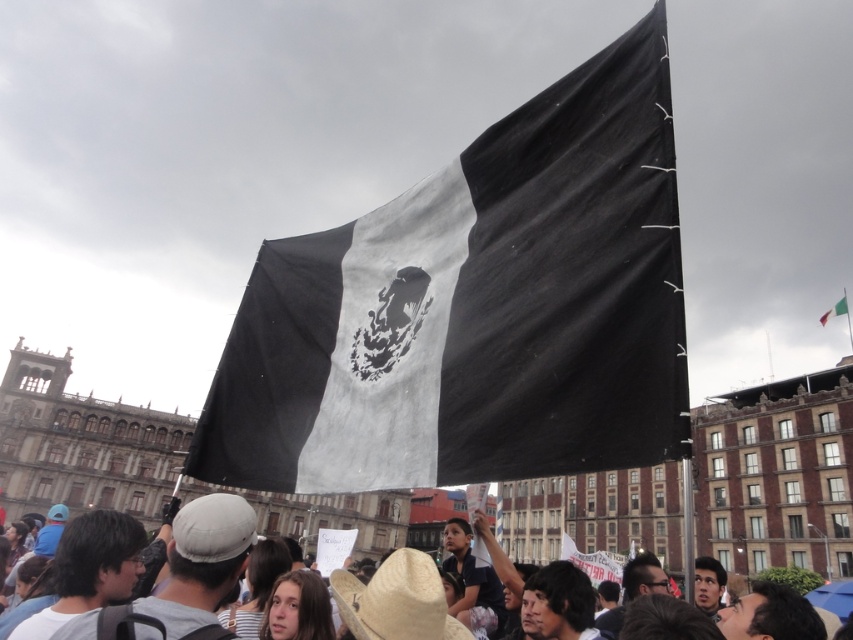
Question: Is black fabric flag at center below white fabric flag at upper center?

Choices:
 (A) yes
 (B) no

Answer: (A)

Question: Is the position of black fabric flag at center less distant than that of white fabric flag at upper center?

Choices:
 (A) no
 (B) yes

Answer: (B)

Question: Among these points, which one is nearest to the camera?

Choices:
 (A) (822, 321)
 (B) (399, 356)

Answer: (B)

Question: Can you confirm if black fabric flag at center is thinner than white fabric flag at upper center?

Choices:
 (A) yes
 (B) no

Answer: (A)